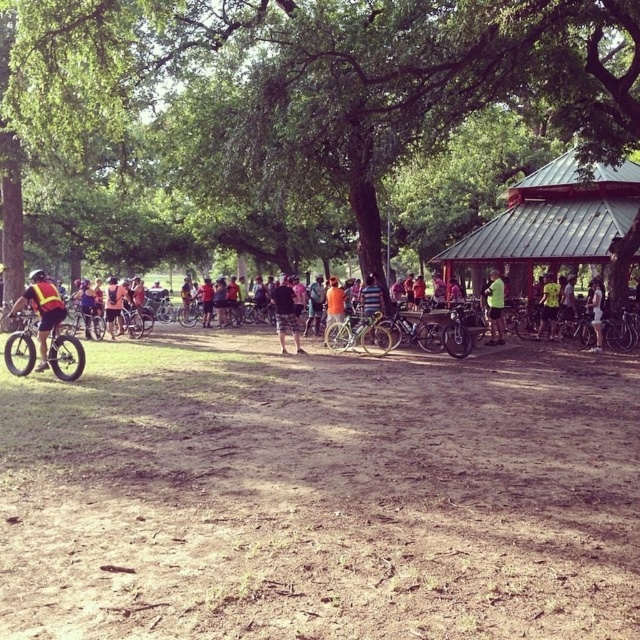
Between brown dirt field at lower center and white cotton shirt at center, which one is positioned higher?

white cotton shirt at center is above.

Is brown dirt field at lower center positioned before white cotton shirt at center?

Yes, brown dirt field at lower center is in front of white cotton shirt at center.

Where is `brown dirt field at lower center`? This screenshot has height=640, width=640. brown dirt field at lower center is located at coordinates (320, 493).

Where is `brown dirt field at lower center`? Image resolution: width=640 pixels, height=640 pixels. brown dirt field at lower center is located at coordinates coord(320,493).

Can you confirm if reflective yellow vest at left is bigger than green fabric shirt at center?

Actually, reflective yellow vest at left might be smaller than green fabric shirt at center.

Looking at this image, is reflective yellow vest at left behind green fabric shirt at center?

That is False.

Looking at this image, who is more forward, (35, 298) or (497, 284)?

Point (35, 298) is in front.

This screenshot has height=640, width=640. Find the location of `reflective yellow vest at left`. reflective yellow vest at left is located at coordinates (42, 312).

Describe the element at coordinates (358, 333) in the screenshot. I see `green matte bicycle at center` at that location.

Can you confirm if green matte bicycle at center is bigger than white matte helmet at center?

No.

What do you see at coordinates (358, 333) in the screenshot? This screenshot has height=640, width=640. I see `green matte bicycle at center` at bounding box center [358, 333].

The width and height of the screenshot is (640, 640). Find the location of `green matte bicycle at center`. green matte bicycle at center is located at coordinates (358, 333).